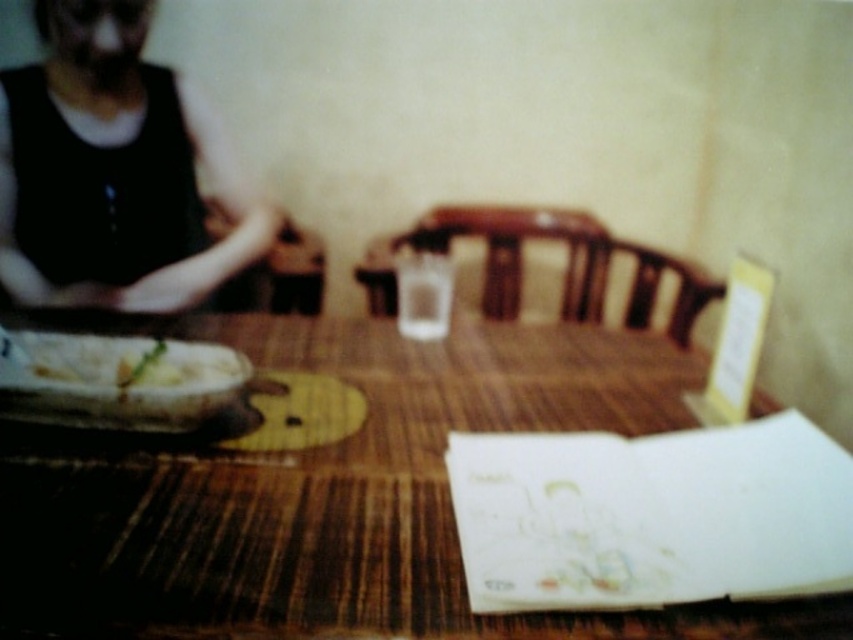
Can you confirm if wooden table at center is positioned below black fabric at left?

Yes, wooden table at center is below black fabric at left.

Does point (91, 627) lie behind point (241, 195)?

No, (91, 627) is in front of (241, 195).

Where is `wooden table at center`? This screenshot has height=640, width=853. wooden table at center is located at coordinates (335, 497).